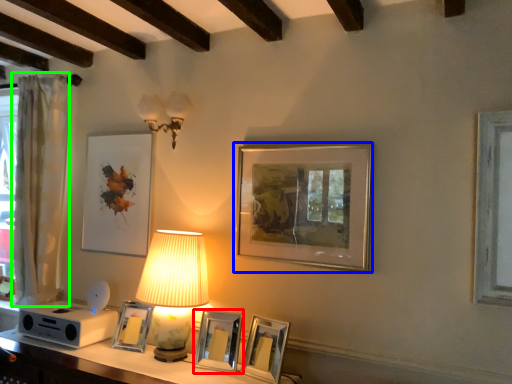
Question: Considering the real-world distances, which object is farthest from picture frame (highlighted by a red box)? picture frame (highlighted by a blue box) or curtain (highlighted by a green box)?

Choices:
 (A) picture frame
 (B) curtain

Answer: (B)